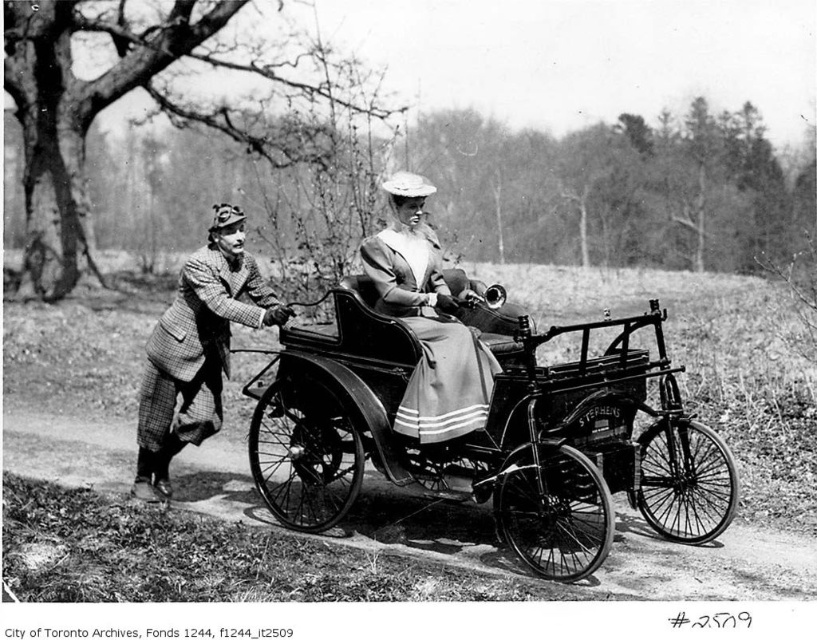
Question: Which of these objects is positioned closest to the matte gray coat at center?

Choices:
 (A) metallic black wagon at center
 (B) plaid wool coat at left

Answer: (A)

Question: Considering the real-world distances, which object is farthest from the plaid wool coat at left?

Choices:
 (A) matte gray coat at center
 (B) metallic black wagon at center

Answer: (B)

Question: Is metallic black wagon at center closer to the viewer compared to matte gray coat at center?

Choices:
 (A) no
 (B) yes

Answer: (B)

Question: Does metallic black wagon at center appear on the right side of matte gray coat at center?

Choices:
 (A) no
 (B) yes

Answer: (A)

Question: Which object is the closest to the metallic black wagon at center?

Choices:
 (A) matte gray coat at center
 (B) plaid wool coat at left

Answer: (A)

Question: From the image, what is the correct spatial relationship of metallic black wagon at center in relation to plaid wool coat at left?

Choices:
 (A) below
 (B) above

Answer: (A)